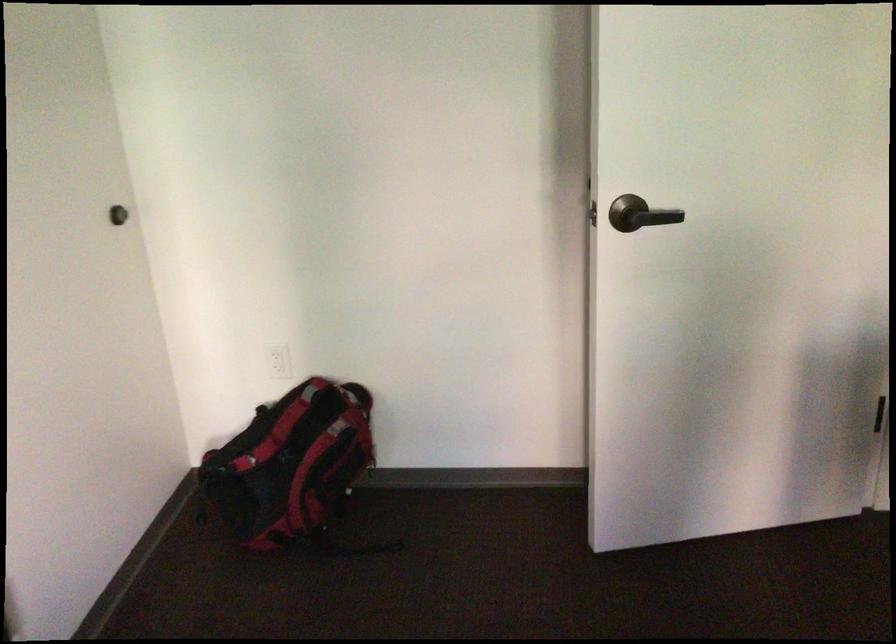
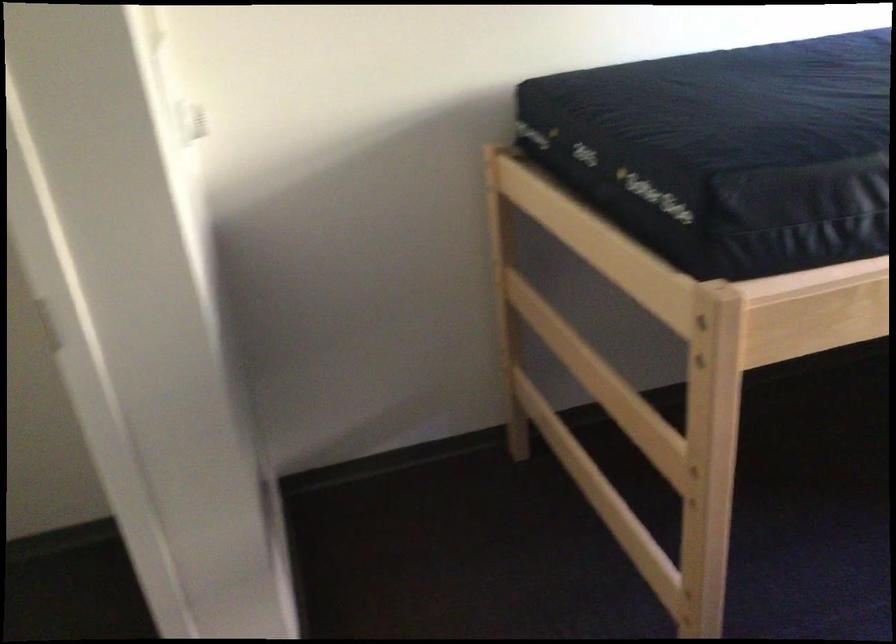
First-person continuous shooting, in which direction is the camera rotating?

The camera rotated toward right-down.